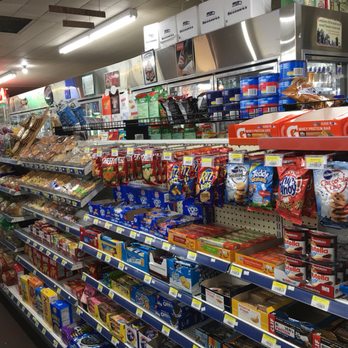
Where is `ceiling`? ceiling is located at coordinates (39, 29).